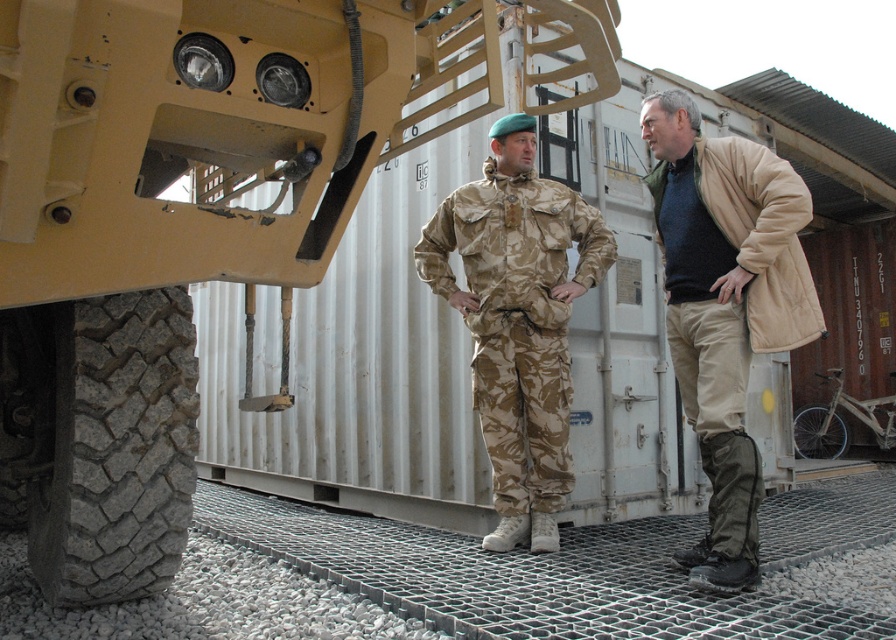
Is point (517, 225) positioned behind point (854, 410)?

No, (517, 225) is closer to viewer.

Which of these two, camouflage fabric uniform at center or white matte bicycle at lower right, stands taller?

camouflage fabric uniform at center is taller.

Describe the element at coordinates (518, 320) in the screenshot. I see `camouflage fabric uniform at center` at that location.

Locate an element on the screen. The height and width of the screenshot is (640, 896). camouflage fabric uniform at center is located at coordinates (518, 320).

Does beige fleece jacket at right lie behind white matte bicycle at lower right?

That is False.

Does point (657, 157) come farther from viewer compared to point (845, 445)?

No, (657, 157) is closer to viewer.

This screenshot has width=896, height=640. What are the coordinates of `beige fleece jacket at right` in the screenshot? It's located at (725, 307).

Who is taller, beige fleece jacket at right or camouflage fabric uniform at center?

beige fleece jacket at right

Is beige fleece jacket at right above camouflage fabric uniform at center?

Yes, beige fleece jacket at right is above camouflage fabric uniform at center.

Which is behind, point (690, 320) or point (582, 259)?

The point (582, 259) is behind.

This screenshot has height=640, width=896. In order to click on beige fleece jacket at right in this screenshot , I will do `click(725, 307)`.